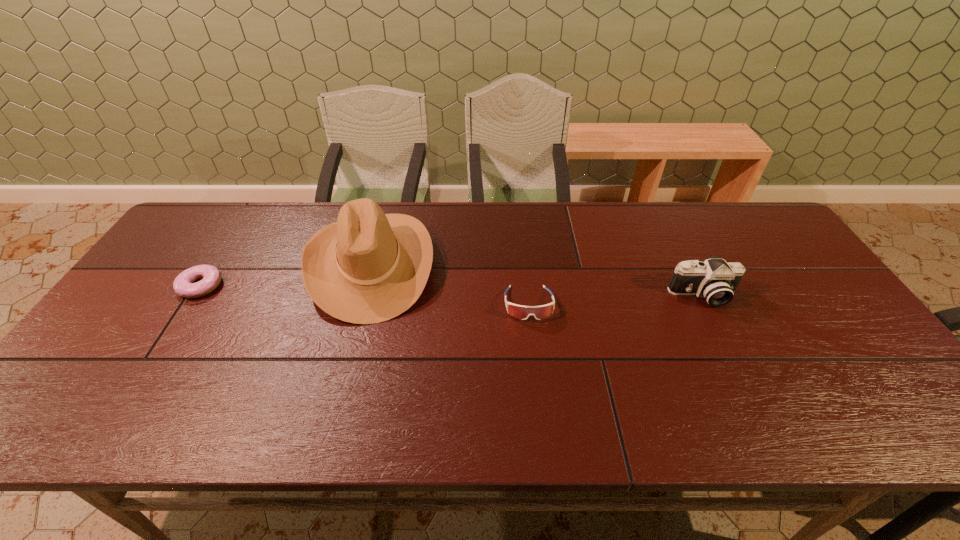
The width and height of the screenshot is (960, 540). I want to click on free space between the cowboy hat and the shortest object, so (x=286, y=274).

Identify the location of free space between the camera and the second shortest object. The height and width of the screenshot is (540, 960). (615, 300).

Identify the location of empty location between the leftmost object and the tallest object. This screenshot has height=540, width=960. (286, 274).

Locate an element on the screen. This screenshot has width=960, height=540. free space between the doughnut and the second object from left to right is located at coordinates (286, 274).

Where is `free spot between the camera and the second object from left to right`? free spot between the camera and the second object from left to right is located at coordinates (537, 279).

This screenshot has width=960, height=540. I want to click on vacant region between the third object from right to left and the doughnut, so click(x=286, y=274).

Where is `object that is the third nearest to the second object from right to left`? This screenshot has width=960, height=540. object that is the third nearest to the second object from right to left is located at coordinates (184, 286).

Locate an element on the screen. the second closest object to the shortest object is located at coordinates (521, 312).

You are a GUI agent. You are given a task and a screenshot of the screen. Output one action in this format:
    pyautogui.click(x=<x>, y=<y>)
    Task: Click on the vacant point that satisfies the following two spatial constraints: 1. on the front side of the rightmost object; 2. on the right side of the cowboy hat
    The height and width of the screenshot is (540, 960).
    Given the screenshot: What is the action you would take?
    pyautogui.click(x=363, y=295)

Locate an element on the screen. The width and height of the screenshot is (960, 540). vacant region that satisfies the following two spatial constraints: 1. on the back side of the shortest object; 2. on the left side of the third object from right to left is located at coordinates (215, 264).